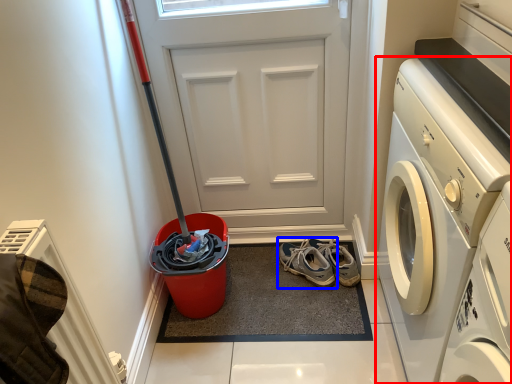
Question: Which of the following is the closest to the observer, washing machine (highlighted by a red box) or footwear (highlighted by a blue box)?

Choices:
 (A) washing machine
 (B) footwear

Answer: (A)